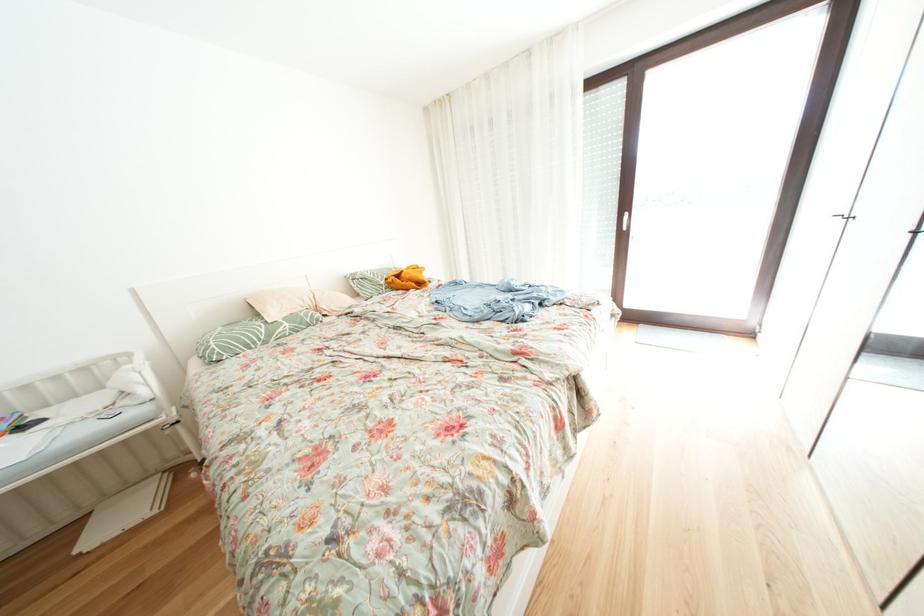
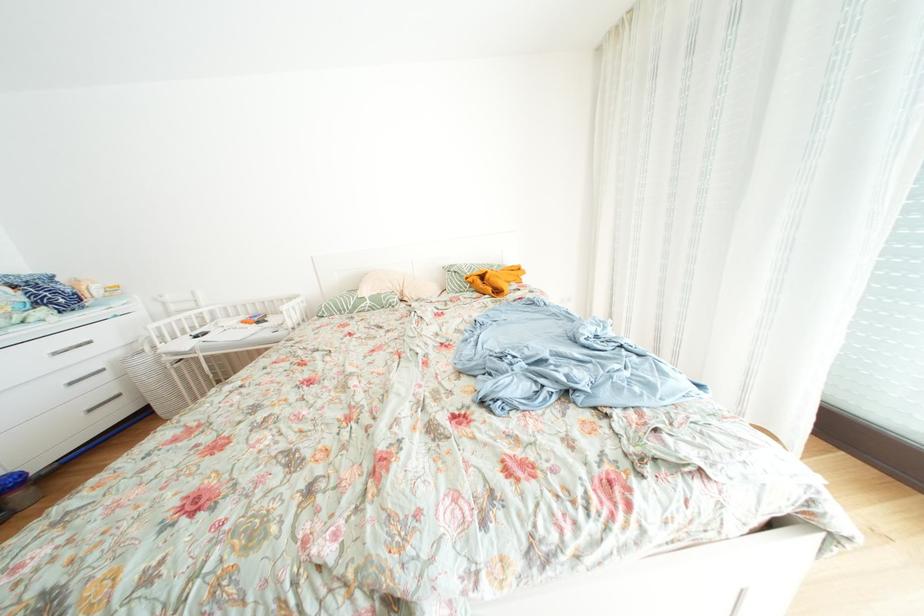
Where in the second image is the point corresponding to point (296, 329) from the first image?

(378, 307)